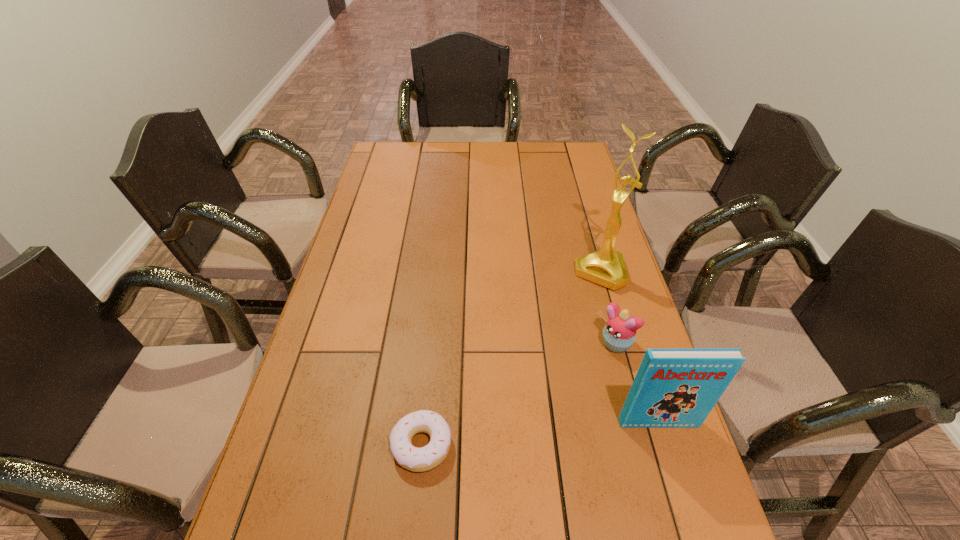
Locate an element on the screen. vacant spot on the desktop that is between the shortest object and the book and is positioned on the face of the second farthest object is located at coordinates (512, 437).

This screenshot has height=540, width=960. I want to click on vacant space on the desktop that is between the leftmost object and the third shortest object and is positioned on the front-facing side of the award, so click(515, 436).